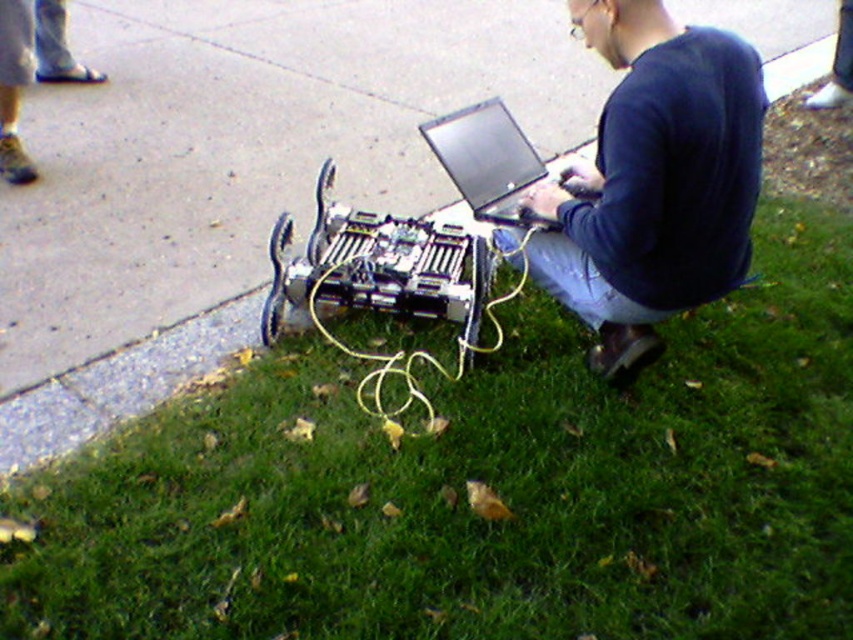
Who is positioned more to the left, dark blue long-sleeve shirt at center or black glossy laptop at center?

black glossy laptop at center

Can you confirm if dark blue long-sleeve shirt at center is positioned to the left of black glossy laptop at center?

No, dark blue long-sleeve shirt at center is not to the left of black glossy laptop at center.

Where is `dark blue long-sleeve shirt at center`? Image resolution: width=853 pixels, height=640 pixels. dark blue long-sleeve shirt at center is located at coordinates (654, 179).

Find the location of a particular element. The height and width of the screenshot is (640, 853). dark blue long-sleeve shirt at center is located at coordinates (654, 179).

Is green grass at lower right thinner than concrete at lower left?

Yes.

Find the location of a particular element. The image size is (853, 640). green grass at lower right is located at coordinates (486, 484).

Does green grass at lower right have a lesser width compared to dark blue long-sleeve shirt at center?

No.

Which is behind, point (289, 403) or point (624, 241)?

The point (289, 403) is behind.

At what (x,y) coordinates should I click in order to perform the action: click on green grass at lower right. Please return your answer as a coordinate pair (x, y). Looking at the image, I should click on (486, 484).